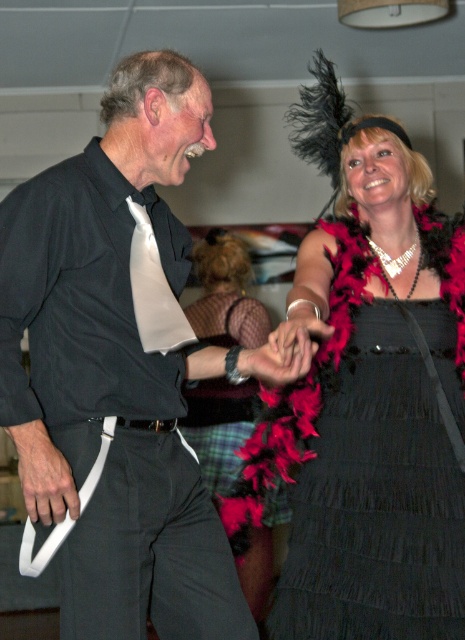
You are a fashion designer analyzing the outfit of the man in the image. Given that the matte black shirt at center and the black leather belt at center are both part of his attire, which of these two items occupies a taller position on his body?

The matte black shirt at center is taller than the black leather belt at center, so the shirt occupies a taller position on his body.

In the scene, there is a point at coordinates (105, 285). What object in the image does this point correspond to?

The point at coordinates (105, 285) corresponds to the matte black shirt at center.